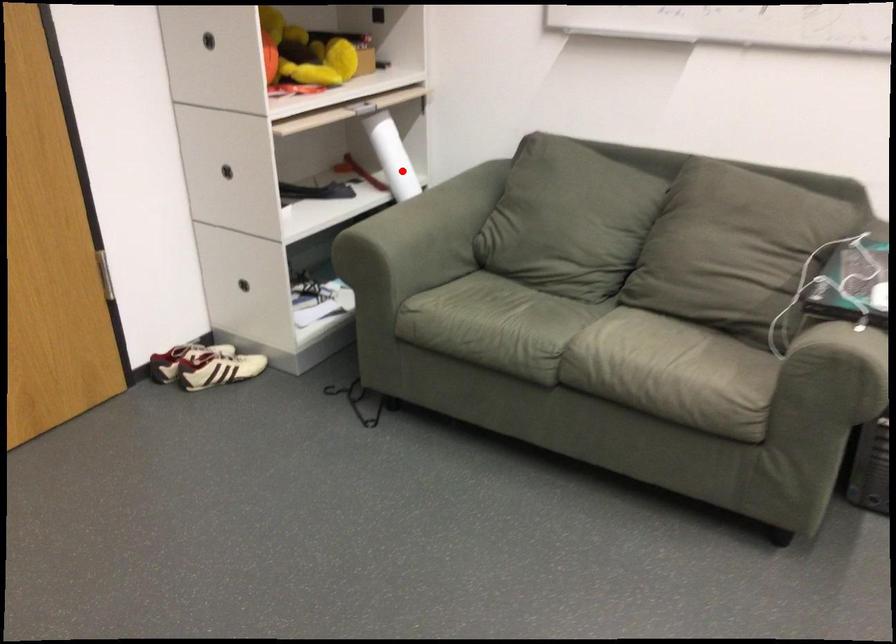
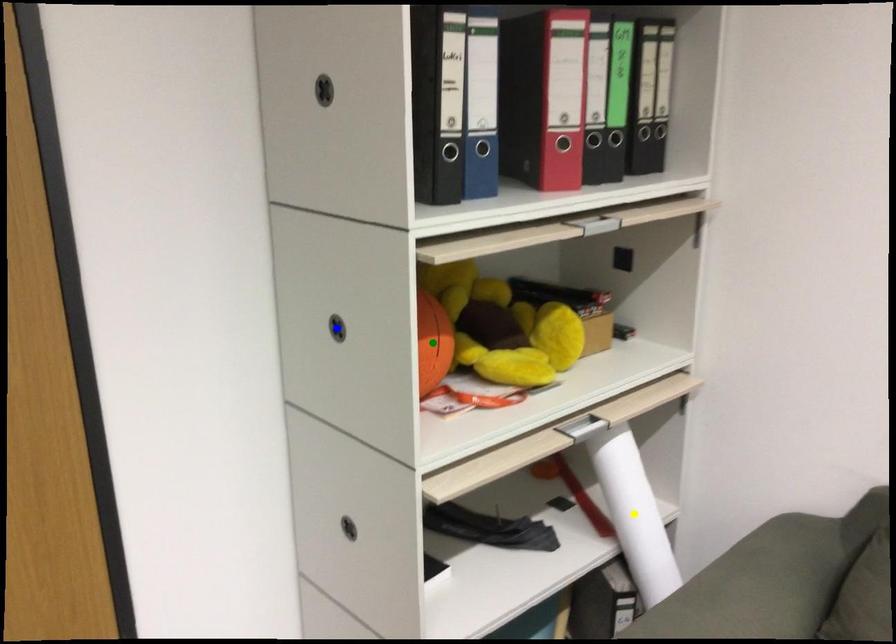
Question: I am providing you with two images of the same scene from different viewpoints. A red point is marked on the first image. You are given multiple points on the second image. Which point in image 2 represents the same 3d spot as the red point in image 1?

Choices:
 (A) blue point
 (B) green point
 (C) yellow point

Answer: (C)